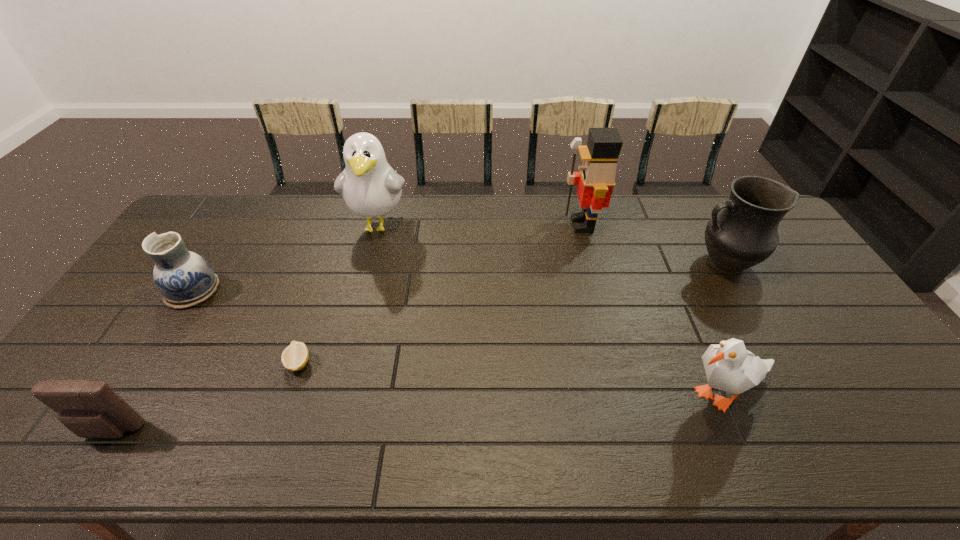
Image resolution: width=960 pixels, height=540 pixels. Find the location of `blank space located 0.190m in front of the nutcracker holding the staff`. blank space located 0.190m in front of the nutcracker holding the staff is located at coordinates (509, 225).

Where is `vacant space situated in front of the nutcracker holding the staff`? vacant space situated in front of the nutcracker holding the staff is located at coordinates (537, 225).

Identify the location of blank space located in front of the nutcracker holding the staff. This screenshot has height=540, width=960. (534, 225).

Locate an element on the screen. free space located 0.340m on the handle side of the pitcher is located at coordinates click(585, 264).

The width and height of the screenshot is (960, 540). In order to click on vacant area situated 0.060m on the handle side of the pitcher in this screenshot , I will do `click(672, 264)`.

The width and height of the screenshot is (960, 540). I want to click on free location located on the handle side of the pitcher, so click(644, 264).

Locate an element on the screen. This screenshot has height=540, width=960. free location located 0.220m at the beak of the nearer gull is located at coordinates (578, 395).

Locate an element on the screen. vacant space located 0.180m at the beak of the nearer gull is located at coordinates (594, 395).

Where is `free point located 0.090m at the beak of the nearer gull`? This screenshot has width=960, height=540. free point located 0.090m at the beak of the nearer gull is located at coordinates (631, 395).

Locate an element on the screen. The image size is (960, 540). free location located on the front of the pottery is located at coordinates [104, 432].